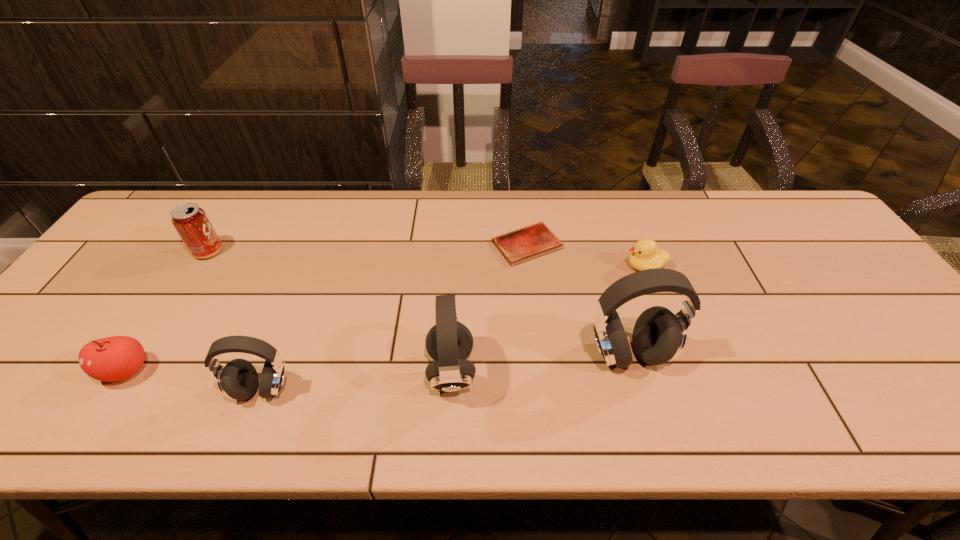
You are a GUI agent. You are given a task and a screenshot of the screen. Output one action in this format:
    pyautogui.click(x=<x>, y=<y>)
    Task: Click on the vacant space that is in between the second headset from left to right and the fifth object from left to right
    The image size is (960, 540).
    Given the screenshot: What is the action you would take?
    pyautogui.click(x=489, y=308)

Image resolution: width=960 pixels, height=540 pixels. In order to click on empty location between the apple and the diary in this screenshot , I will do `click(326, 308)`.

You are a GUI agent. You are given a task and a screenshot of the screen. Output one action in this format:
    pyautogui.click(x=<x>, y=<y>)
    Task: Click on the unoccupied position between the tallest object and the sixth tallest object
    
    Given the screenshot: What is the action you would take?
    pyautogui.click(x=636, y=310)

The width and height of the screenshot is (960, 540). I want to click on free space that is in between the second tallest object and the shortest object, so click(x=489, y=308).

Where is `object that stands as the fifth closest to the sixth tallest object`? Image resolution: width=960 pixels, height=540 pixels. object that stands as the fifth closest to the sixth tallest object is located at coordinates (191, 222).

Identify which object is located as the sixth nearest to the soda can. Please provide its 2D coordinates. Your answer should be formatted as a tuple, i.e. [(x, y)], where the tuple contains the x and y coordinates of a point satisfying the conditions above.

[(644, 254)]

Identify which headset is the closest to the fifth tallest object. Please provide its 2D coordinates. Your answer should be formatted as a tuple, i.e. [(x, y)], where the tuple contains the x and y coordinates of a point satisfying the conditions above.

[(238, 380)]

Locate an element on the screen. The width and height of the screenshot is (960, 540). headset that stands as the second closest to the duckling is located at coordinates (449, 342).

Locate an element on the screen. The height and width of the screenshot is (540, 960). vacant position in the image that satisfies the following two spatial constraints: 1. on the ear cups of the tallest object; 2. on the ear cups of the fourth object from left to right is located at coordinates (634, 371).

You are a GUI agent. You are given a task and a screenshot of the screen. Output one action in this format:
    pyautogui.click(x=<x>, y=<y>)
    Task: Click on the vacant point that satisfies the following two spatial constraints: 1. on the beak of the duckling; 2. on the ear cups of the fifth object from right to left
    
    Given the screenshot: What is the action you would take?
    pyautogui.click(x=689, y=389)